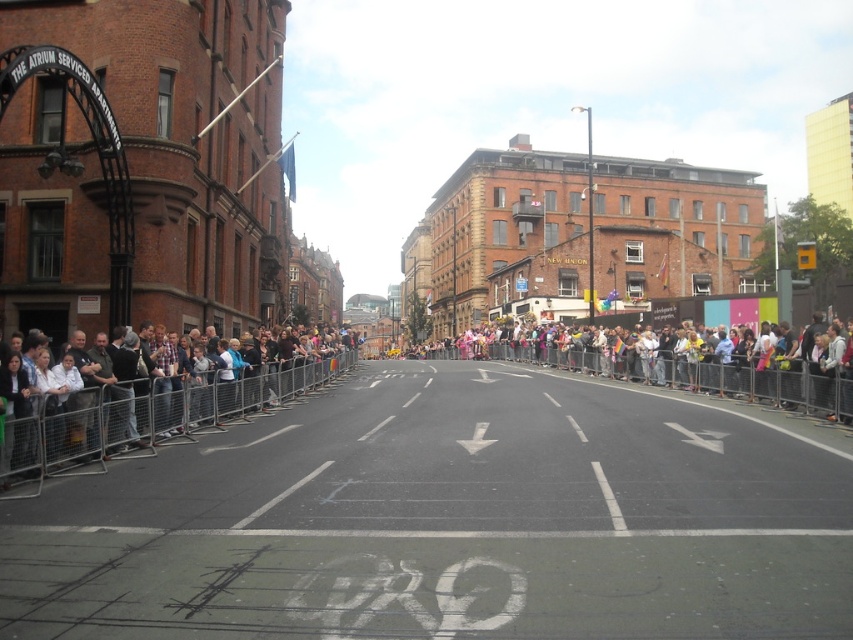
Question: Can you confirm if metal barricade at left is wider than multicolored fabric crowd at center?

Choices:
 (A) no
 (B) yes

Answer: (A)

Question: Does metal barricade at left have a larger size compared to multicolored fabric crowd at center?

Choices:
 (A) yes
 (B) no

Answer: (B)

Question: Which of the following is the closest to the observer?

Choices:
 (A) metal barricade at left
 (B) multicolored fabric crowd at center

Answer: (A)

Question: Does metal barricade at left appear on the right side of multicolored fabric crowd at center?

Choices:
 (A) no
 (B) yes

Answer: (A)